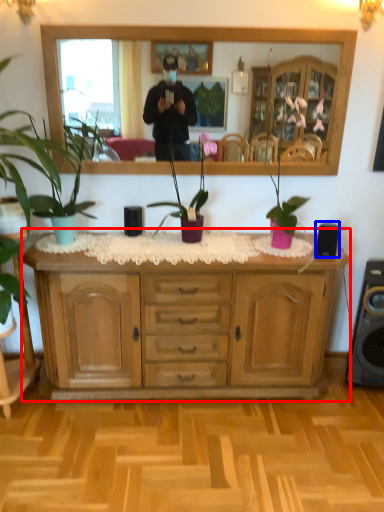
Question: Which object is closer to the camera taking this photo, cabinetry (highlighted by a red box) or speaker (highlighted by a blue box)?

Choices:
 (A) cabinetry
 (B) speaker

Answer: (A)